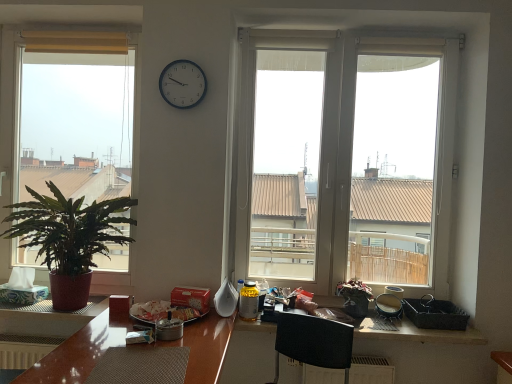
Question: Does point (126, 44) appear closer or farther from the camera than point (190, 100)?

Choices:
 (A) farther
 (B) closer

Answer: (A)

Question: From the image's perspective, is green matte plant at left, which appears as the 1th window when viewed from the left, above or below metallic clock at upper center?

Choices:
 (A) above
 (B) below

Answer: (B)

Question: Estimate the real-world distances between objects in this image. Which object is farther from the white matte tissue at left?

Choices:
 (A) black plastic picnic basket at lower right
 (B) yellow plastic bottle at center
 (C) green matte plant at left, which appears as the 1th window when viewed from the left
 (D) white plastic window at center, positioned as the 1th window in right-to-left order
 (E) wooden textured counter top at lower center

Answer: (D)

Question: Estimate the real-world distances between objects in this image. Which object is closer to the yellow plastic bottle at center?

Choices:
 (A) matte yellow curtain at upper left
 (B) white matte tissue at left
 (C) green matte plant at center, marked as the 1th houseplant in a right-to-left arrangement
 (D) metallic clock at upper center
 (E) wooden textured counter top at lower center

Answer: (C)